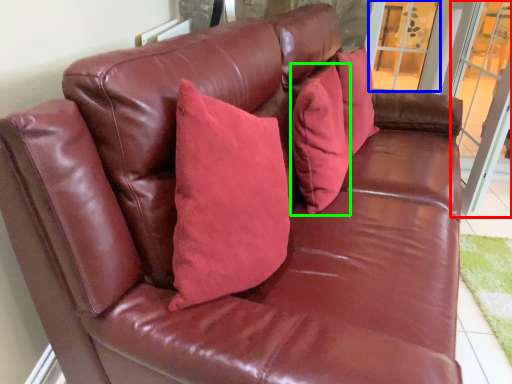
Question: Estimate the real-world distances between objects in this image. Which object is farther from screen door (highlighted by a red box), window (highlighted by a blue box) or pillow (highlighted by a green box)?

Choices:
 (A) window
 (B) pillow

Answer: (B)